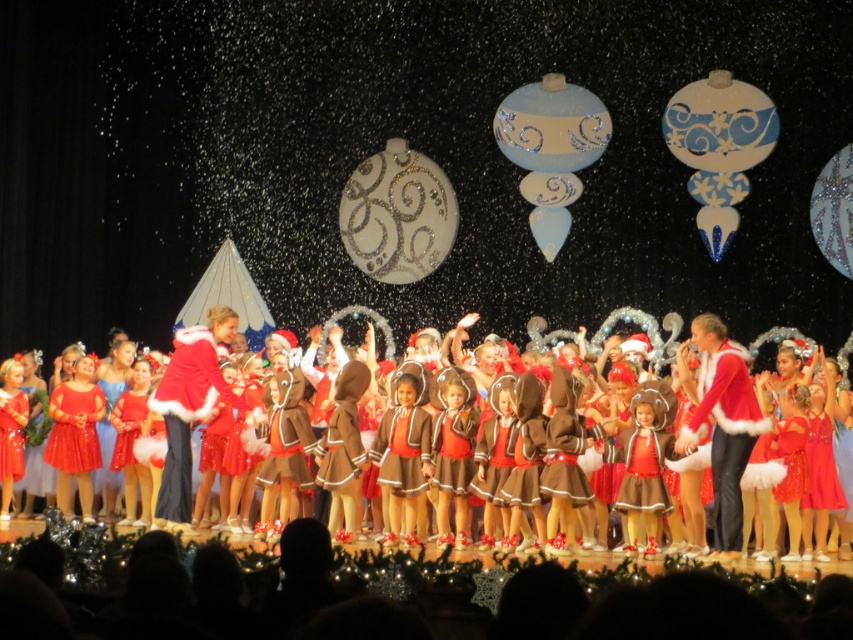
Does shiny red dresses at center appear under matte red dress at left?

No, shiny red dresses at center is not below matte red dress at left.

Is shiny red dresses at center shorter than matte red dress at left?

No.

Does point (703, 456) come closer to viewer compared to point (88, 400)?

That is True.

Find the location of `shiny red dresses at center`. shiny red dresses at center is located at coordinates (784, 460).

Does matte red dress at left appear on the left side of shiny red dress at center?

Incorrect, matte red dress at left is not on the left side of shiny red dress at center.

What do you see at coordinates (74, 428) in the screenshot?
I see `matte red dress at left` at bounding box center [74, 428].

In order to click on matte red dress at left in this screenshot , I will do `click(74, 428)`.

Which is more to the right, shiny red dresses at center or shiny red dress at center?

Positioned to the right is shiny red dresses at center.

What do you see at coordinates (784, 460) in the screenshot? I see `shiny red dresses at center` at bounding box center [784, 460].

At what (x,y) coordinates should I click in order to perform the action: click on shiny red dresses at center. Please return your answer as a coordinate pair (x, y). Looking at the image, I should click on (784, 460).